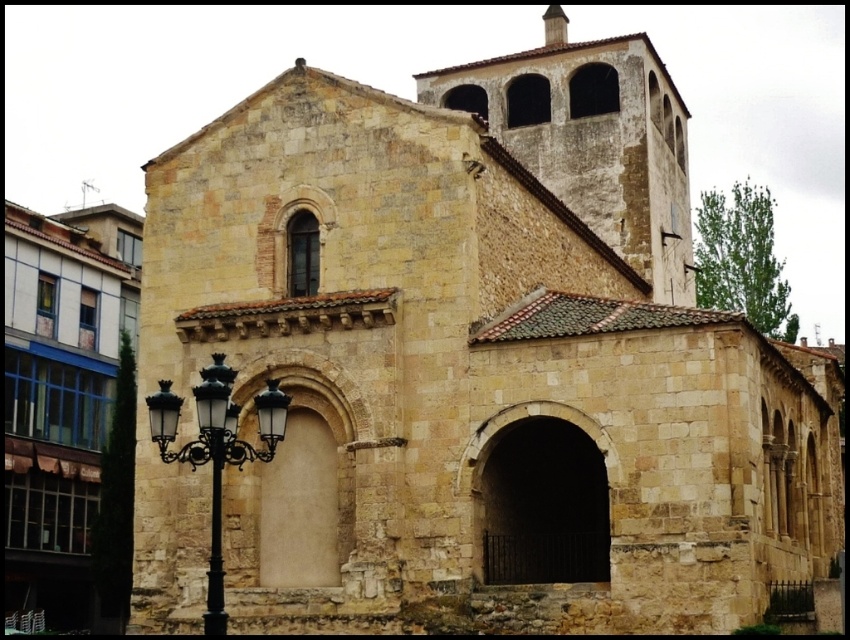
Question: Which point is closer to the camera?

Choices:
 (A) (34, 532)
 (B) (219, 515)

Answer: (B)

Question: Is beige stone church at left positioned before black wrought iron streetlight at lower left?

Choices:
 (A) yes
 (B) no

Answer: (B)

Question: Which point is farther to the camera?

Choices:
 (A) black wrought iron streetlight at lower left
 (B) beige stone church at left

Answer: (B)

Question: Can you confirm if beige stone church at left is positioned to the left of black wrought iron streetlight at lower left?

Choices:
 (A) no
 (B) yes

Answer: (B)

Question: Can you confirm if beige stone church at left is smaller than black wrought iron streetlight at lower left?

Choices:
 (A) no
 (B) yes

Answer: (A)